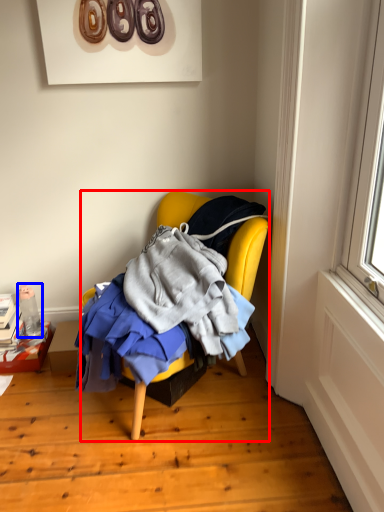
Question: Which of the following is the closest to the observer, chair (highlighted by a red box) or bottle (highlighted by a blue box)?

Choices:
 (A) chair
 (B) bottle

Answer: (A)